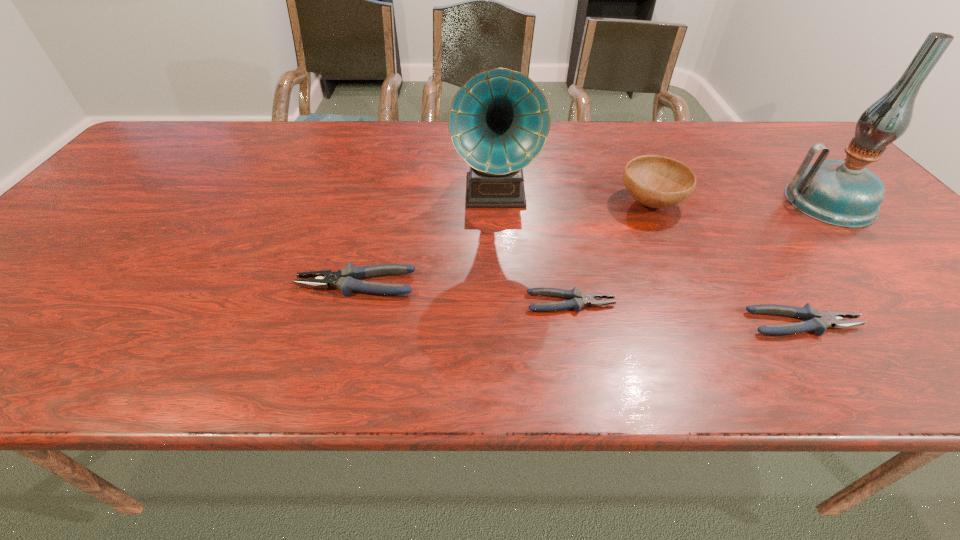
Please point a spot on the left to add another pliers. Please provide its 2D coordinates. Your answer should be formatted as a tuple, i.e. [(x, y)], where the tuple contains the x and y coordinates of a point satisfying the conditions above.

[(157, 266)]